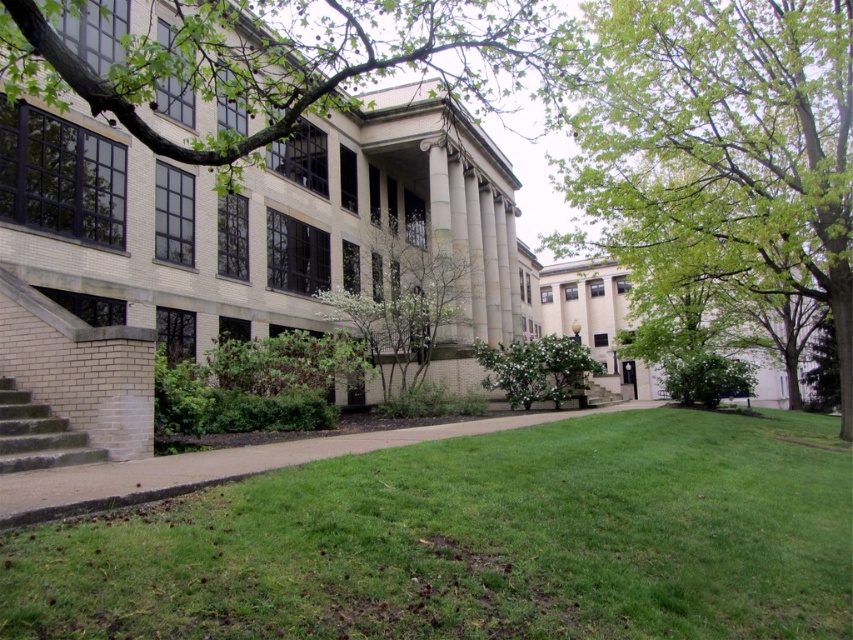
From the picture: Can you confirm if green grass at lower center is positioned to the right of green leafy tree at center?

Yes, green grass at lower center is to the right of green leafy tree at center.

Does green grass at lower center have a lesser height compared to green leafy tree at center?

Correct, green grass at lower center is not as tall as green leafy tree at center.

Is point (363, 548) positioned before point (440, 275)?

Yes, point (363, 548) is closer to viewer.

The image size is (853, 640). In order to click on green grass at lower center in this screenshot , I will do `click(474, 541)`.

Does green grass at lower center have a larger size compared to green leafy bush at center?

Correct, green grass at lower center is larger in size than green leafy bush at center.

Which is above, green grass at lower center or green leafy bush at center?

green leafy bush at center is above.

Which is behind, point (666, 465) or point (519, 355)?

Positioned behind is point (519, 355).

Where is `green grass at lower center`? This screenshot has height=640, width=853. green grass at lower center is located at coordinates (474, 541).

Who is more distant from viewer, (x=646, y=161) or (x=593, y=365)?

Point (x=646, y=161)

Locate an element on the screen. This screenshot has width=853, height=640. green leafy tree at upper right is located at coordinates (721, 147).